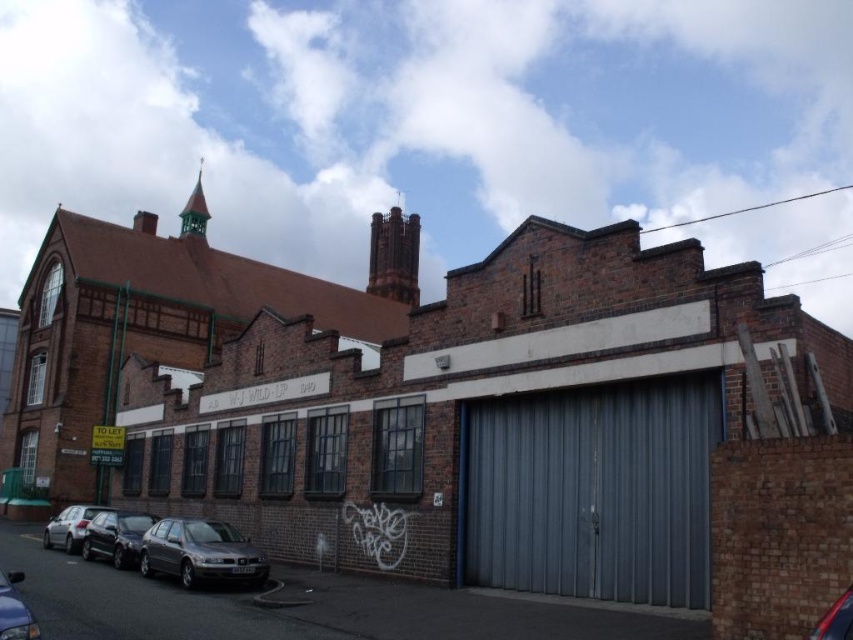
You are standing in front of the building and want to park your car. The metallic gray sedan at lower left is already parked there. Can you see the gray corrugated metal garage door at center from your current position?

Yes, because the gray corrugated metal garage door at center is closer to you than the metallic gray sedan at lower left, so it is blocking your view of the sedan but you can still see the garage door itself.

You are a delivery person trying to park your van in front of the building. There are two vehicles blocking the entrance. The vehicles are a metallic gray sedan at lower left and a metallic gray car at lower left. Which vehicle should you move first to clear the path?

You should move the metallic gray car at lower left first because the metallic gray sedan at lower left is to the right of it, meaning the metallic gray car at lower left is closer to the entrance and blocking the path more directly.